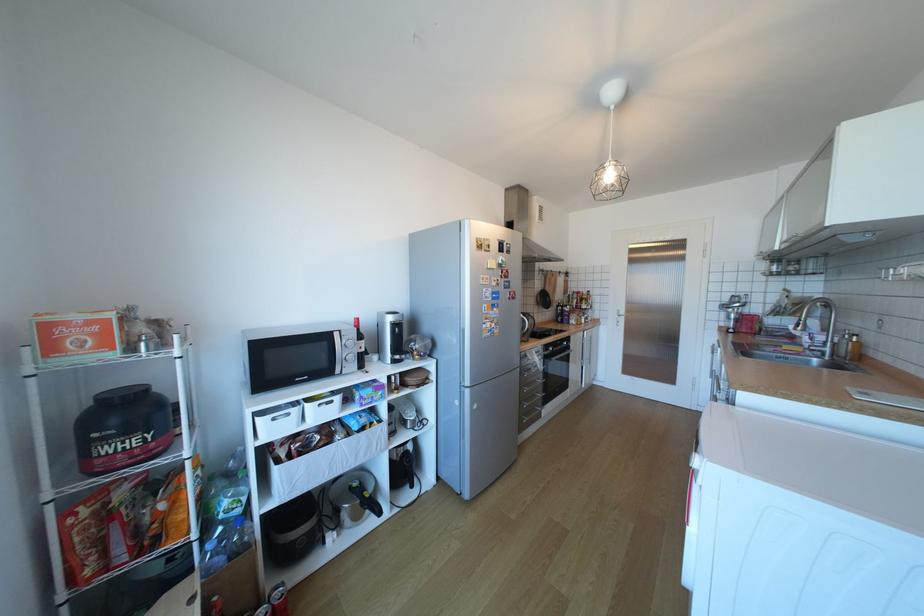
Find where to lift the pressure cooker handle. Please return your answer as a coordinate pair (x, y).

(410, 467)